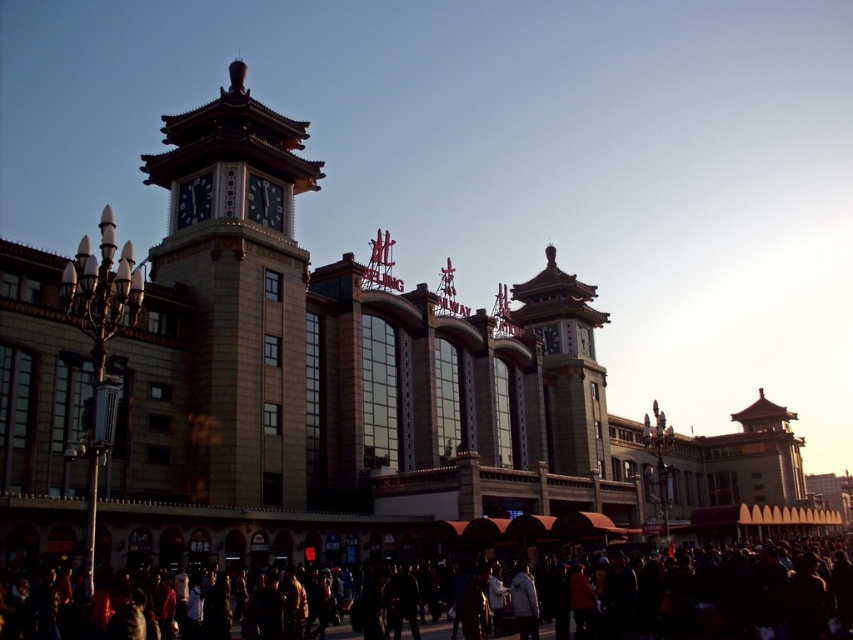
Can you confirm if beige stone clock tower at center-left is smaller than golden stone tower at center?

Indeed, beige stone clock tower at center-left has a smaller size compared to golden stone tower at center.

Is point (212, 241) positioned in front of point (572, 404)?

Yes, it is in front of point (572, 404).

Which is in front, point (236, 195) or point (558, 310)?

Point (236, 195) is in front.

This screenshot has width=853, height=640. In order to click on beige stone clock tower at center-left in this screenshot , I will do `click(239, 298)`.

In the scene shown: Is beige stone clock tower at center-left positioned before dark clothing at lower center?

No.

Is beige stone clock tower at center-left taller than dark clothing at lower center?

Yes.

This screenshot has height=640, width=853. What do you see at coordinates (239, 298) in the screenshot?
I see `beige stone clock tower at center-left` at bounding box center [239, 298].

The image size is (853, 640). I want to click on beige stone clock tower at center-left, so click(239, 298).

Consider the image. Can you confirm if golden stone tower at center is taller than metallic clock face at upper center?

Correct, golden stone tower at center is much taller as metallic clock face at upper center.

Is golden stone tower at center bigger than metallic clock face at upper center?

Indeed, golden stone tower at center has a larger size compared to metallic clock face at upper center.

Describe the element at coordinates (567, 365) in the screenshot. This screenshot has width=853, height=640. I see `golden stone tower at center` at that location.

In order to click on golden stone tower at center in this screenshot , I will do `click(567, 365)`.